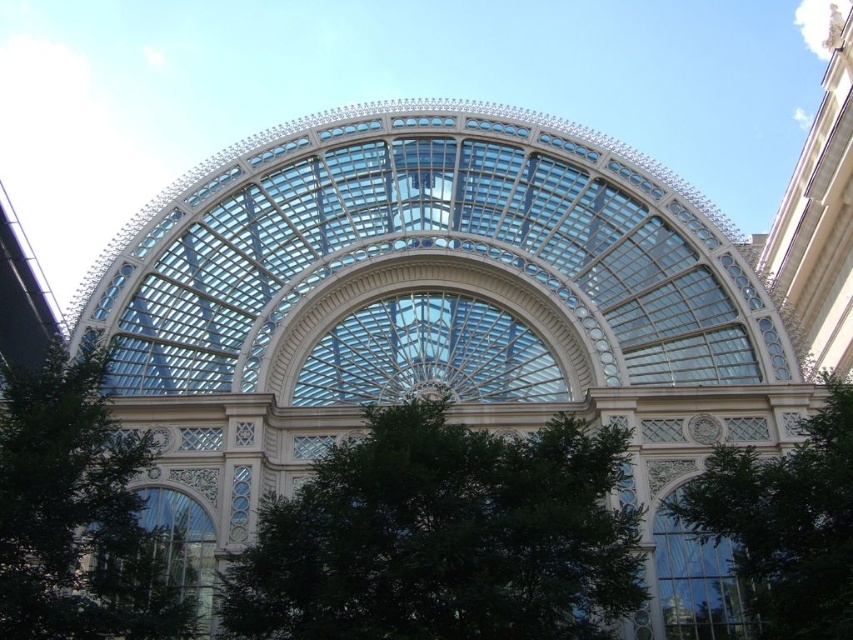
Who is lower down, green leafy tree at center or green leafy tree at lower right?

green leafy tree at center is lower down.

Between point (422, 545) and point (837, 392), which one is positioned behind?

Positioned behind is point (837, 392).

Between point (457, 452) and point (799, 513), which one is positioned behind?

The point (457, 452) is behind.

Locate an element on the screen. Image resolution: width=853 pixels, height=640 pixels. green leafy tree at center is located at coordinates (444, 536).

This screenshot has height=640, width=853. What are the coordinates of `green leafy tree at lower left` in the screenshot? It's located at (79, 513).

Who is positioned more to the right, green leafy tree at lower left or green leafy tree at lower right?

green leafy tree at lower right

You are a GUI agent. You are given a task and a screenshot of the screen. Output one action in this format:
    pyautogui.click(x=<x>, y=<y>)
    Task: Click on the green leafy tree at lower left
    This screenshot has width=853, height=640.
    Given the screenshot: What is the action you would take?
    pyautogui.click(x=79, y=513)

What are the coordinates of `green leafy tree at center` in the screenshot? It's located at (444, 536).

Who is more forward, (425, 460) or (1, 570)?

Point (1, 570) is more forward.

Identify the location of green leafy tree at center. (444, 536).